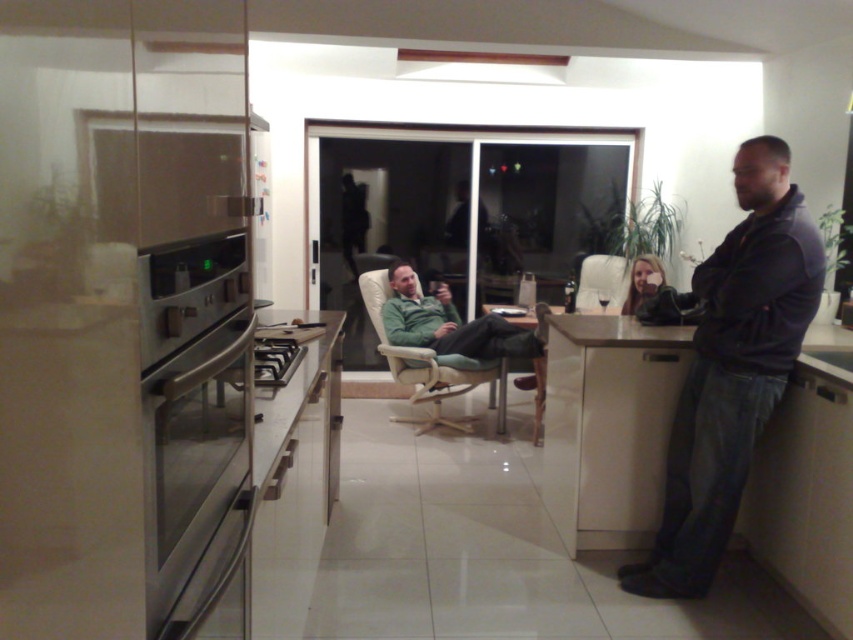
Which of these two, stainless steel oven at left or light beige fabric armchair at center, stands shorter?

With less height is stainless steel oven at left.

Which is more to the right, stainless steel oven at left or light beige fabric armchair at center?

From the viewer's perspective, light beige fabric armchair at center appears more on the right side.

Between point (190, 548) and point (445, 362), which one is positioned behind?

The point (445, 362) is behind.

The width and height of the screenshot is (853, 640). Find the location of `stainless steel oven at left`. stainless steel oven at left is located at coordinates (194, 419).

Does point (231, 333) lie in front of point (641, 314)?

That is True.

Looking at this image, which is above, stainless steel oven at left or matte black hair at center?

matte black hair at center is above.

Which is in front, point (204, 276) or point (672, 312)?

Point (204, 276) is more forward.

Image resolution: width=853 pixels, height=640 pixels. In order to click on stainless steel oven at left in this screenshot , I will do `click(194, 419)`.

Does light beige fabric armchair at center appear on the left side of white leather armchair at center?

Indeed, light beige fabric armchair at center is positioned on the left side of white leather armchair at center.

Measure the distance between light beige fabric armchair at center and camera.

The distance of light beige fabric armchair at center from camera is 4.45 meters.

Where is `light beige fabric armchair at center`? Image resolution: width=853 pixels, height=640 pixels. light beige fabric armchair at center is located at coordinates (428, 365).